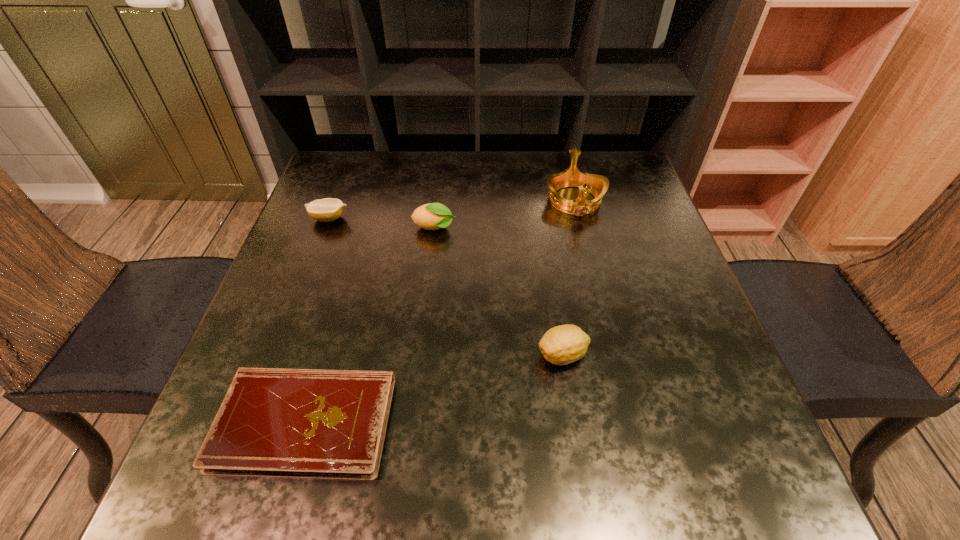
The width and height of the screenshot is (960, 540). I want to click on tiara, so click(597, 185).

Identify the location of the second lemon from left to right. (432, 216).

Image resolution: width=960 pixels, height=540 pixels. Identify the location of the nearest lemon. (561, 345).

Locate an element on the screen. the fourth farthest object is located at coordinates (561, 345).

The width and height of the screenshot is (960, 540). What are the coordinates of `the fourth tallest object` in the screenshot? It's located at (328, 209).

Identify the location of the shortest lemon. The height and width of the screenshot is (540, 960). (328, 209).

At what (x,y) coordinates should I click in order to perform the action: click on the shortest object. Please return your answer as a coordinate pair (x, y). The image size is (960, 540). Looking at the image, I should click on (293, 423).

You are a GUI agent. You are given a task and a screenshot of the screen. Output one action in this format:
    pyautogui.click(x=<x>, y=<y>)
    Task: Click on the nearest object
    Image resolution: width=960 pixels, height=540 pixels.
    Given the screenshot: What is the action you would take?
    pyautogui.click(x=293, y=423)

Image resolution: width=960 pixels, height=540 pixels. Identify the location of vacant area situated at the front emblem of the tiara. (604, 320).

At what (x,y) coordinates should I click in order to perform the action: click on vacant space situated 0.380m with leaves positioned above the second lemon from right to left. Please return your answer as a coordinate pair (x, y). The height and width of the screenshot is (540, 960). Looking at the image, I should click on (613, 228).